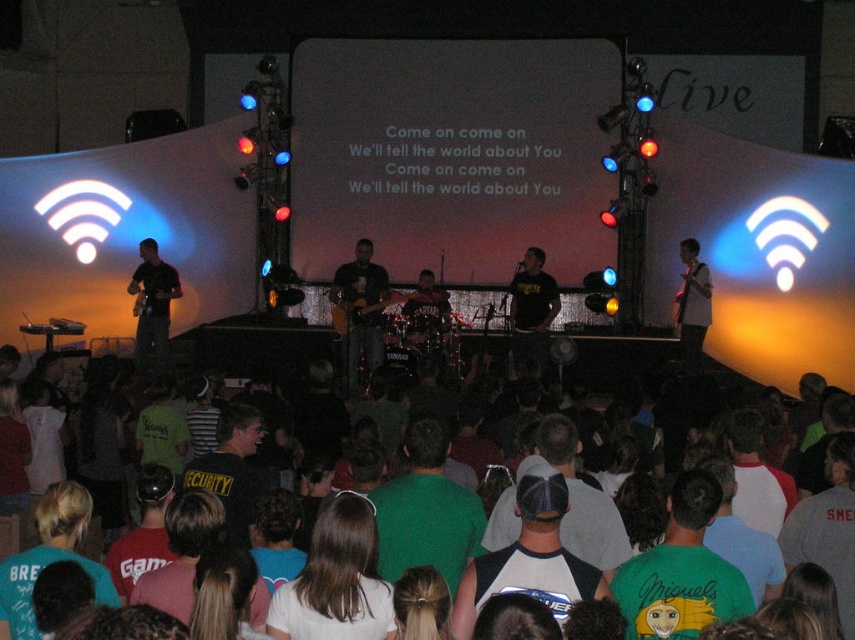
Can you confirm if dark gray mesh cap at center is wider than black matte shirt at center?

Indeed, dark gray mesh cap at center has a greater width compared to black matte shirt at center.

Does point (616, 557) lie behind point (523, 365)?

That is False.

Where is `dark gray mesh cap at center`? dark gray mesh cap at center is located at coordinates (579, 499).

Locate an element on the screen. The height and width of the screenshot is (640, 855). dark gray mesh cap at center is located at coordinates (579, 499).

Is point (439, 502) farther from camera compared to point (500, 520)?

Yes, point (439, 502) is behind point (500, 520).

Describe the element at coordinates (426, 512) in the screenshot. I see `green t-shirt at center` at that location.

At what (x,y) coordinates should I click in order to perform the action: click on green t-shirt at center. Please return your answer as a coordinate pair (x, y). This screenshot has height=640, width=855. Looking at the image, I should click on (426, 512).

Who is shorter, white matte shirt at center or camouflage shirt at left?

Standing shorter between the two is white matte shirt at center.

Is white matte shirt at center wider than camouflage shirt at left?

Correct, the width of white matte shirt at center exceeds that of camouflage shirt at left.

Who is more forward, (267, 620) or (164, 275)?

Point (267, 620)

Where is `white matte shirt at center`? Image resolution: width=855 pixels, height=640 pixels. white matte shirt at center is located at coordinates (335, 580).